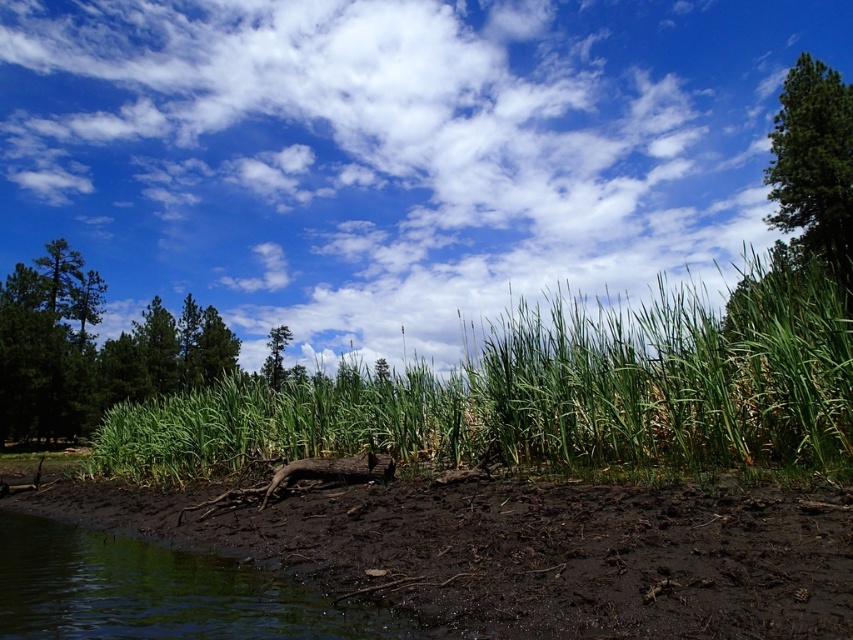
Who is shorter, green matte tree at upper left or green matte tree at center?

green matte tree at center

Can you confirm if green matte tree at upper left is positioned above green matte tree at center?

Correct, green matte tree at upper left is located above green matte tree at center.

Between point (10, 296) and point (291, 333), which one is positioned behind?

Positioned behind is point (291, 333).

Identify the location of green matte tree at upper left. This screenshot has height=640, width=853. pyautogui.click(x=91, y=349).

Who is shorter, green matte tree at upper left or green leafy tree at upper right?

green leafy tree at upper right

Can you confirm if green matte tree at upper left is wider than green leafy tree at upper right?

Yes.

Does point (126, 342) lie behind point (770, 129)?

No.

What are the coordinates of `green matte tree at upper left` in the screenshot? It's located at (91, 349).

Is brown muddy ground at lower left below green liquid at lower left?

Incorrect, brown muddy ground at lower left is not positioned below green liquid at lower left.

Can you confirm if brown muddy ground at lower left is thinner than green liquid at lower left?

Incorrect, brown muddy ground at lower left's width is not less than green liquid at lower left's.

Image resolution: width=853 pixels, height=640 pixels. I want to click on brown muddy ground at lower left, so click(x=527, y=552).